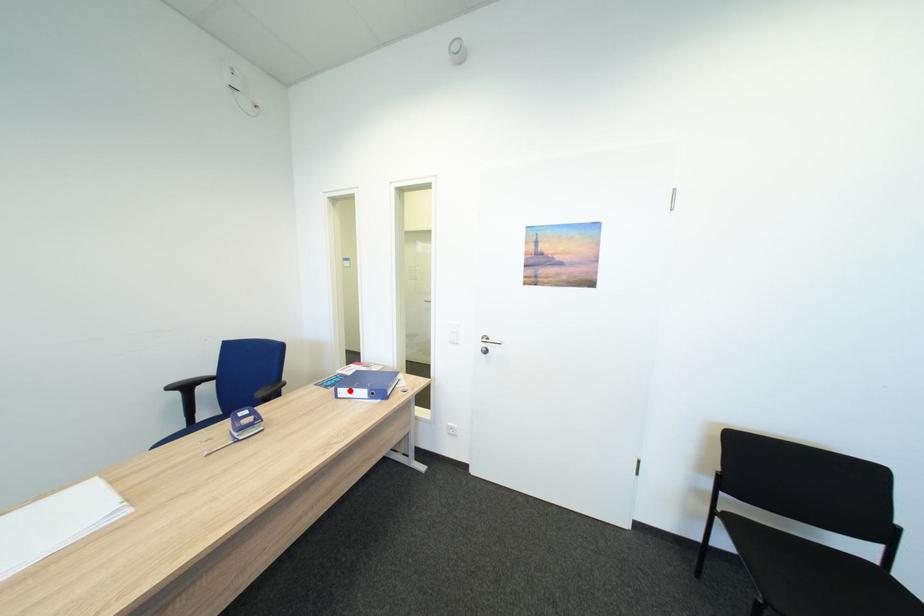
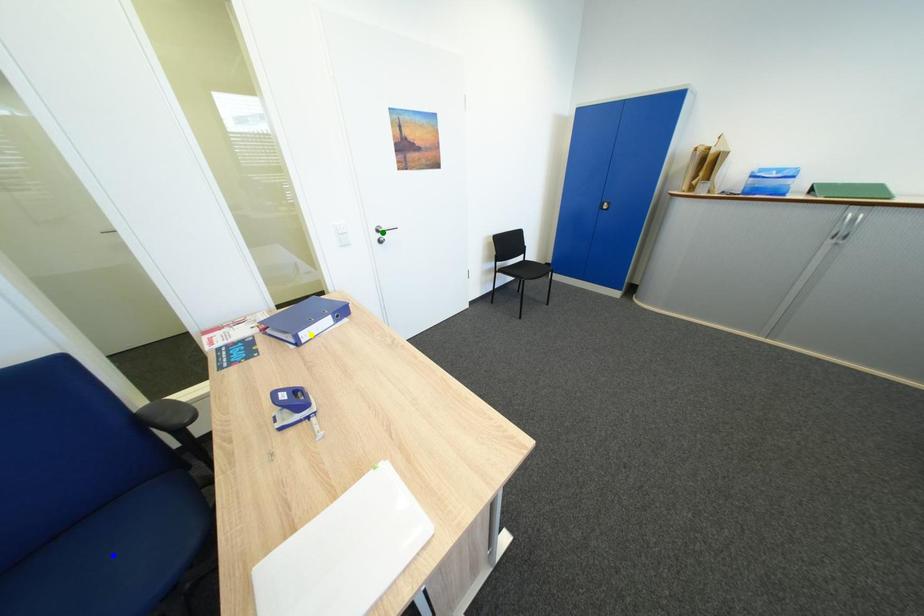
Question: I am providing you with two images of the same scene from different viewpoints. A red point is marked on the first image. You are given multiple points on the second image. Which point in image 2 is actually the same real-world point as the red point in image 1?

Choices:
 (A) green point
 (B) blue point
 (C) yellow point

Answer: (C)